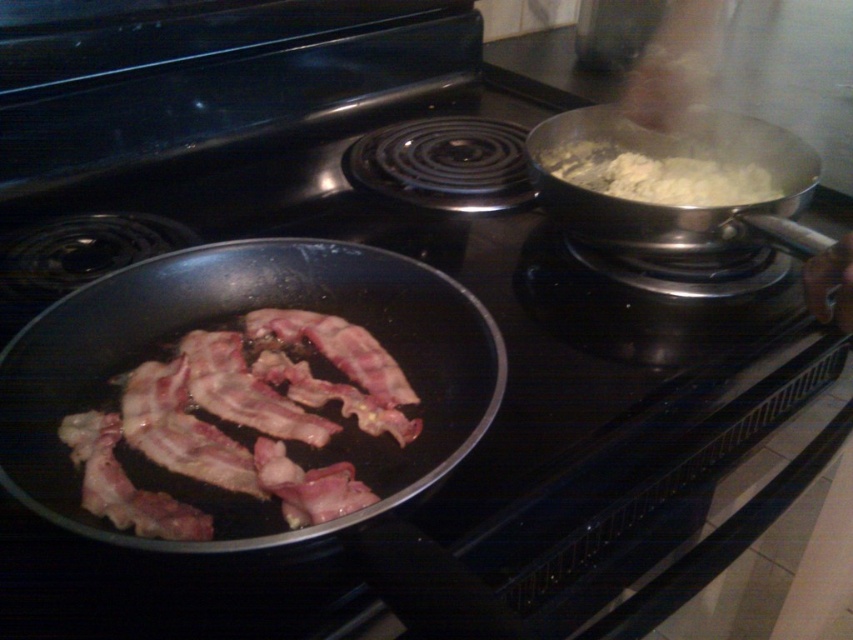
Based on the photo, does slightly browned metal pan at center appear over white fluffy food at upper right?

Actually, slightly browned metal pan at center is below white fluffy food at upper right.

Between slightly browned metal pan at center and white fluffy food at upper right, which one appears on the right side from the viewer's perspective?

Positioned to the right is white fluffy food at upper right.

You are a GUI agent. You are given a task and a screenshot of the screen. Output one action in this format:
    pyautogui.click(x=<x>, y=<y>)
    Task: Click on the slightly browned metal pan at center
    
    Given the screenshot: What is the action you would take?
    point(223,326)

Where is `slightly browned metal pan at center`? The width and height of the screenshot is (853, 640). slightly browned metal pan at center is located at coordinates (223, 326).

Where is `white matte pan at upper right`? This screenshot has width=853, height=640. white matte pan at upper right is located at coordinates pyautogui.click(x=671, y=205).

Is white matte pan at upper right to the left of white fluffy food at upper right from the viewer's perspective?

Indeed, white matte pan at upper right is positioned on the left side of white fluffy food at upper right.

Is point (604, 120) closer to camera compared to point (666, 205)?

No, (604, 120) is behind (666, 205).

The image size is (853, 640). In order to click on white matte pan at upper right in this screenshot , I will do `click(671, 205)`.

Who is lower down, slightly browned metal pan at center or white matte pan at upper right?

slightly browned metal pan at center is lower down.

Can you confirm if slightly browned metal pan at center is bigger than white matte pan at upper right?

Yes.

Who is more forward, (437,388) or (780,218)?

Point (437,388)

Locate an element on the screen. The image size is (853, 640). slightly browned metal pan at center is located at coordinates (223, 326).